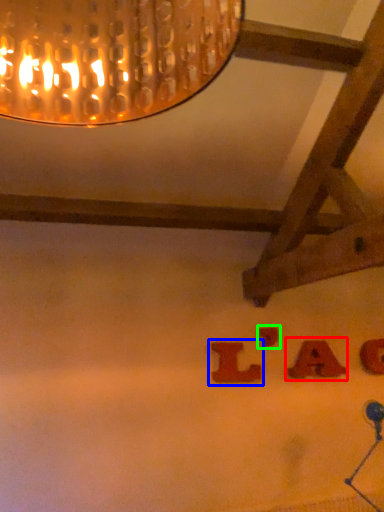
Question: Estimate the real-world distances between objects in this image. Which object is farther from alphabet (highlighted by a red box), alphabet (highlighted by a blue box) or alphabet (highlighted by a green box)?

Choices:
 (A) alphabet
 (B) alphabet

Answer: (A)